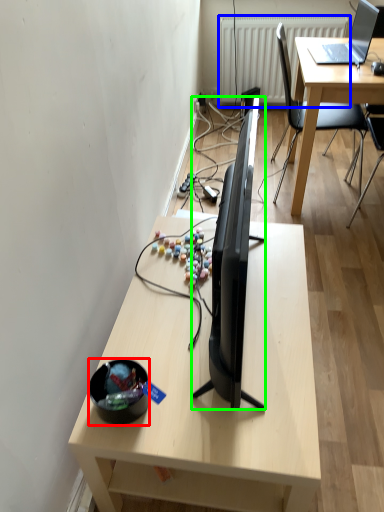
Question: Which is farther away from bowl (highlighted by a red box)? radiator (highlighted by a blue box) or television (highlighted by a green box)?

Choices:
 (A) radiator
 (B) television

Answer: (A)